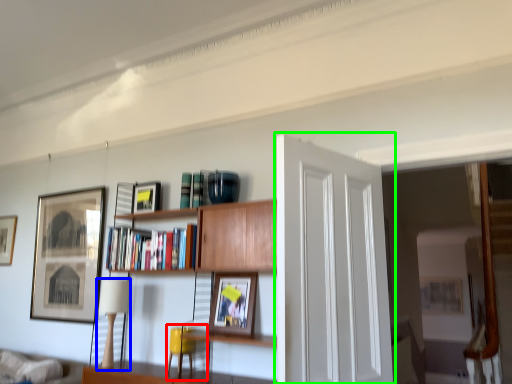
Question: Which object is the closest to the swivel chair (highlighted by a red box)? Choose among these: lamp (highlighted by a blue box) or door (highlighted by a green box).

Choices:
 (A) lamp
 (B) door

Answer: (A)